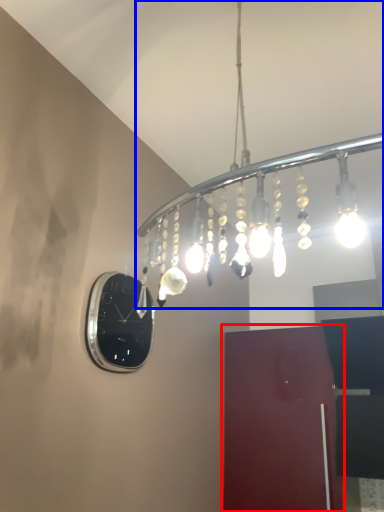
Question: Among these objects, which one is farthest to the camera, door (highlighted by a red box) or lamp (highlighted by a blue box)?

Choices:
 (A) door
 (B) lamp

Answer: (A)